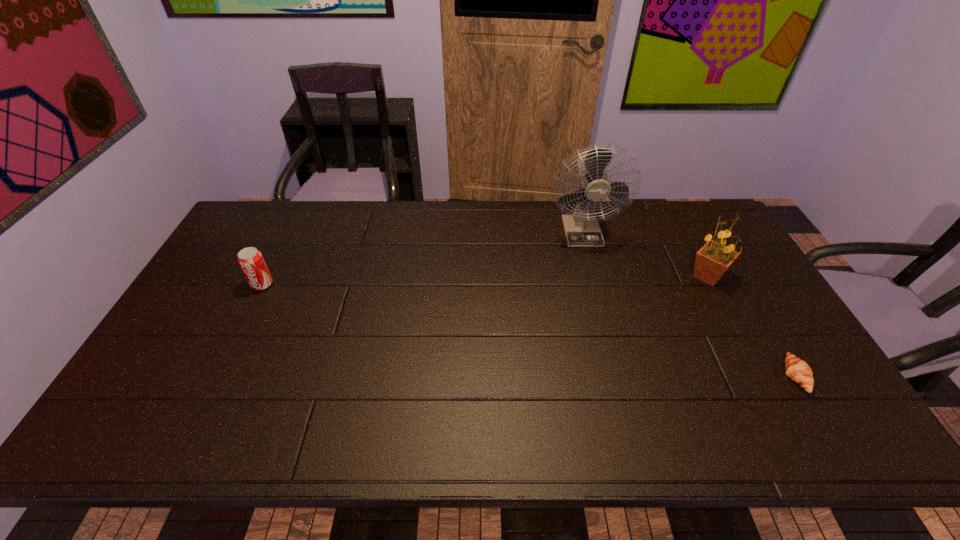
In order to click on vacant position located 0.160m at the front of the sunflower with flowers visible in this screenshot , I will do `click(635, 276)`.

You are a GUI agent. You are given a task and a screenshot of the screen. Output one action in this format:
    pyautogui.click(x=<x>, y=<y>)
    Task: Click on the blank space located on the logo side of the second shortest object
    This screenshot has height=540, width=960.
    Given the screenshot: What is the action you would take?
    pyautogui.click(x=251, y=307)

In order to click on vacant space located on the front-facing side of the shortest object in this screenshot , I will do `click(664, 376)`.

What are the coordinates of `free location located on the front-facing side of the shortest object` in the screenshot? It's located at (649, 376).

Locate an element on the screen. The width and height of the screenshot is (960, 540). free spot located 0.190m on the front-facing side of the shortest object is located at coordinates (708, 376).

Where is `object present at the far edge`? The width and height of the screenshot is (960, 540). object present at the far edge is located at coordinates (581, 229).

You are a GUI agent. You are given a task and a screenshot of the screen. Output one action in this format:
    pyautogui.click(x=<x>, y=<y>)
    Task: Click on the object located at the left edge
    This screenshot has width=960, height=540.
    Given the screenshot: What is the action you would take?
    pyautogui.click(x=250, y=260)

This screenshot has width=960, height=540. Identify the location of sunflower that is positioned at the right edge. (714, 258).

Locate an element on the screen. pastry present at the right edge is located at coordinates (798, 370).

Find the location of a particular element. vacant area at the far edge of the desktop is located at coordinates (439, 227).